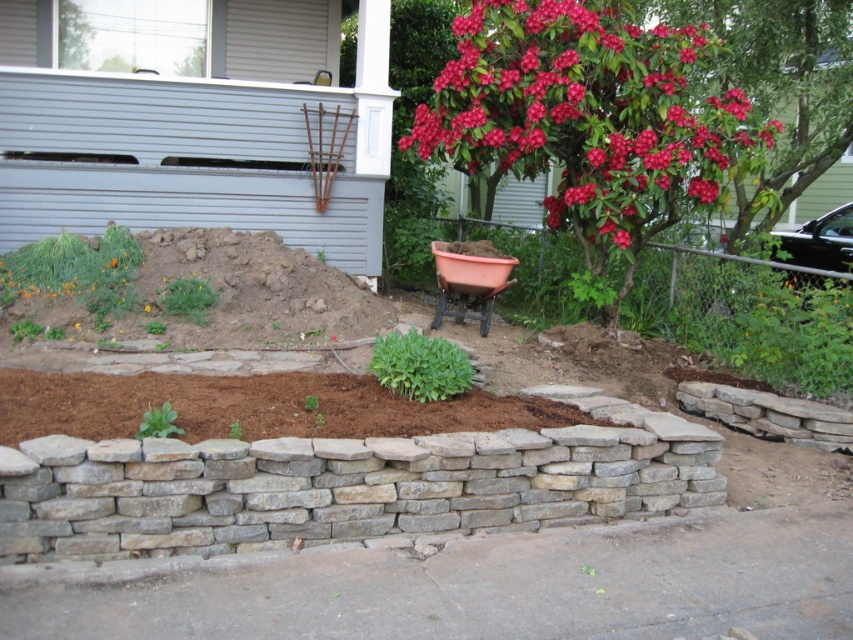
Which is more to the right, red glossy flower at upper right or brown mulch at center?

red glossy flower at upper right

Does point (476, 170) come in front of point (97, 406)?

No.

Where is `red glossy flower at upper right`? red glossy flower at upper right is located at coordinates (589, 116).

The height and width of the screenshot is (640, 853). Describe the element at coordinates (252, 406) in the screenshot. I see `brown mulch at center` at that location.

Who is taller, brown mulch at center or terracotta clay pot at center?

terracotta clay pot at center is taller.

Which is behind, point (462, 406) or point (440, 244)?

The point (440, 244) is behind.

This screenshot has width=853, height=640. In order to click on brown mulch at center in this screenshot , I will do `click(252, 406)`.

Between red glossy flower at upper right and terracotta clay pot at center, which one is positioned higher?

red glossy flower at upper right

Does red glossy flower at upper right lie in front of terracotta clay pot at center?

Yes, it is in front of terracotta clay pot at center.

Who is more distant from viewer, (514, 161) or (439, 243)?

The point (439, 243) is more distant.

Identify the location of red glossy flower at upper right. (589, 116).